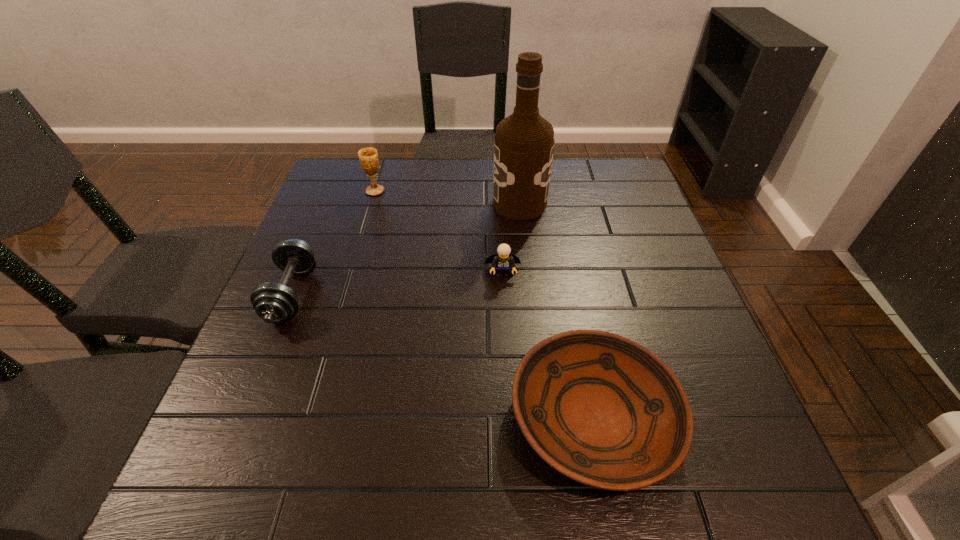
Where is `vacant region that satisfies the following two spatial constraints: 1. on the label of the shortest object; 2. on the right side of the tallest object`? Image resolution: width=960 pixels, height=540 pixels. vacant region that satisfies the following two spatial constraints: 1. on the label of the shortest object; 2. on the right side of the tallest object is located at coordinates (542, 417).

Locate an element on the screen. This screenshot has width=960, height=540. free space that satisfies the following two spatial constraints: 1. on the label of the alcohol; 2. on the front-facing side of the Lego is located at coordinates (527, 273).

Find the location of `vacant space that satisfies the following two spatial constraints: 1. on the label of the alcohol; 2. on the front-facing side of the Lego`. vacant space that satisfies the following two spatial constraints: 1. on the label of the alcohol; 2. on the front-facing side of the Lego is located at coordinates (527, 273).

I want to click on blank area in the image that satisfies the following two spatial constraints: 1. on the front-facing side of the nearest object; 2. on the left side of the Lego, so click(511, 417).

This screenshot has width=960, height=540. What are the coordinates of `vacant space that satisfies the following two spatial constraints: 1. on the label of the shortest object; 2. on the right side of the alcohol` in the screenshot? It's located at (542, 417).

At what (x,y) coordinates should I click in order to perform the action: click on vacant space that satisfies the following two spatial constraints: 1. on the back side of the nearest object; 2. on the label of the alcohol. Please return your answer as a coordinate pair (x, y). Image resolution: width=960 pixels, height=540 pixels. Looking at the image, I should click on (552, 204).

Locate an element on the screen. vacant space that satisfies the following two spatial constraints: 1. on the front-facing side of the Lego; 2. on the right side of the nearest object is located at coordinates (511, 417).